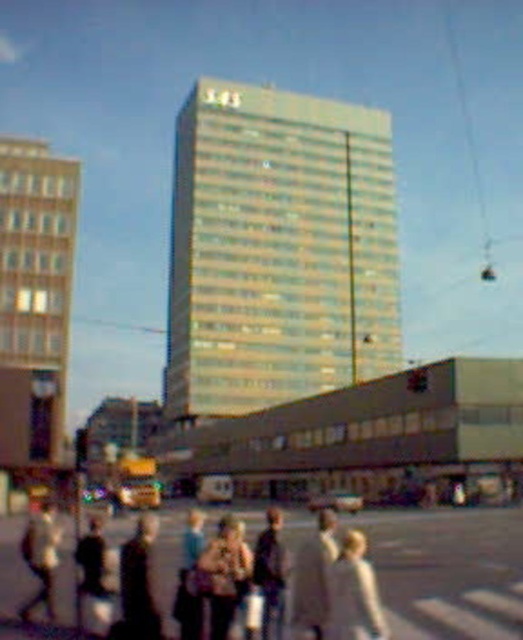
You are a photographer standing at the point marked by coordinates point [270,573]. Looking at the scene, which object is directly in front of you?

The dark brown leather jacket at center is directly in front of you at the coordinates point [270,573].

You are a photographer standing at the pedestrian crossing. You want to take a photo of the light brown leather jacket at center and the metallic silver traffic light at center. Which object is taller in the image?

The light brown leather jacket at center is taller than the metallic silver traffic light at center according to the description.

You are a photographer standing at the pedestrian crossing. You want to take a photo of the light beige jacket at lower center and the metallic silver traffic light at center. Which object is bigger in the photo?

The light beige jacket at lower center is larger in size compared to the metallic silver traffic light at center in the photo.